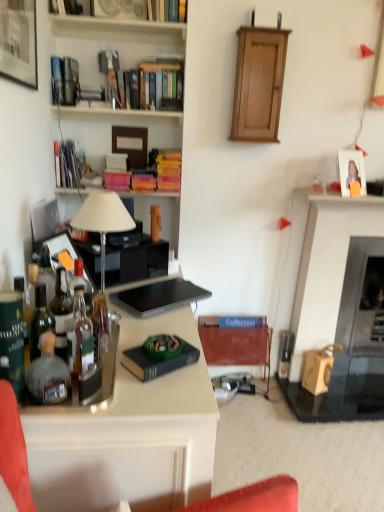
Find the location of a particular element. The height and width of the screenshot is (512, 384). free location above light brown wood cabinet at upper center (from a real-world perspective) is located at coordinates (261, 30).